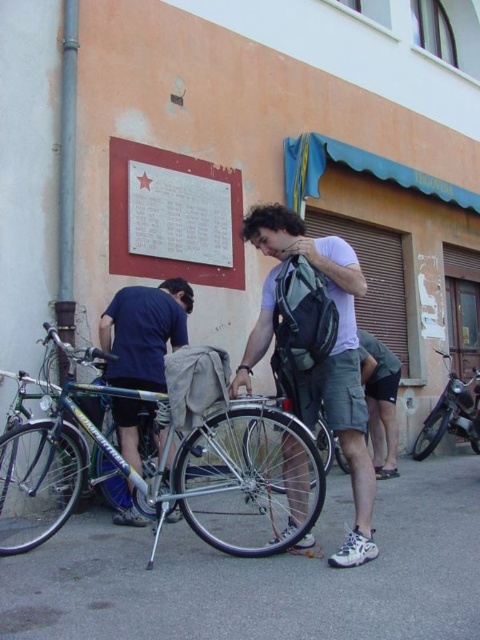
Question: Which is nearer to the shiny metallic bicycle at center?

Choices:
 (A) matte gray backpack at center
 (B) blue fabric pants at lower left
 (C) white matte signboard at upper left

Answer: (C)

Question: Does white matte signboard at upper left appear over shiny metallic bicycle at center?

Choices:
 (A) no
 (B) yes

Answer: (B)

Question: From the image, what is the correct spatial relationship of green metallic bicycle at center in relation to shiny metallic bicycle at center?

Choices:
 (A) above
 (B) below

Answer: (A)

Question: Which object is closer to the camera taking this photo?

Choices:
 (A) green metallic bicycle at center
 (B) shiny metallic bicycle at center
 (C) blue fabric pants at lower left

Answer: (A)

Question: Which point is farther from the camera taking this photo?

Choices:
 (A) (187, 504)
 (B) (182, 289)
 (C) (233, 227)

Answer: (C)

Question: Is matte gray backpack at center bigger than blue fabric pants at lower left?

Choices:
 (A) no
 (B) yes

Answer: (A)